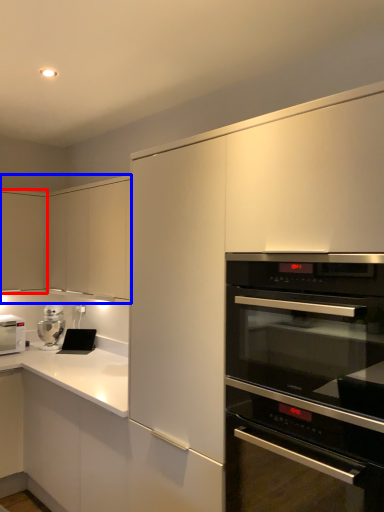
Question: Which of the following is the closest to the observer, cabinetry (highlighted by a red box) or cabinetry (highlighted by a blue box)?

Choices:
 (A) cabinetry
 (B) cabinetry

Answer: (B)